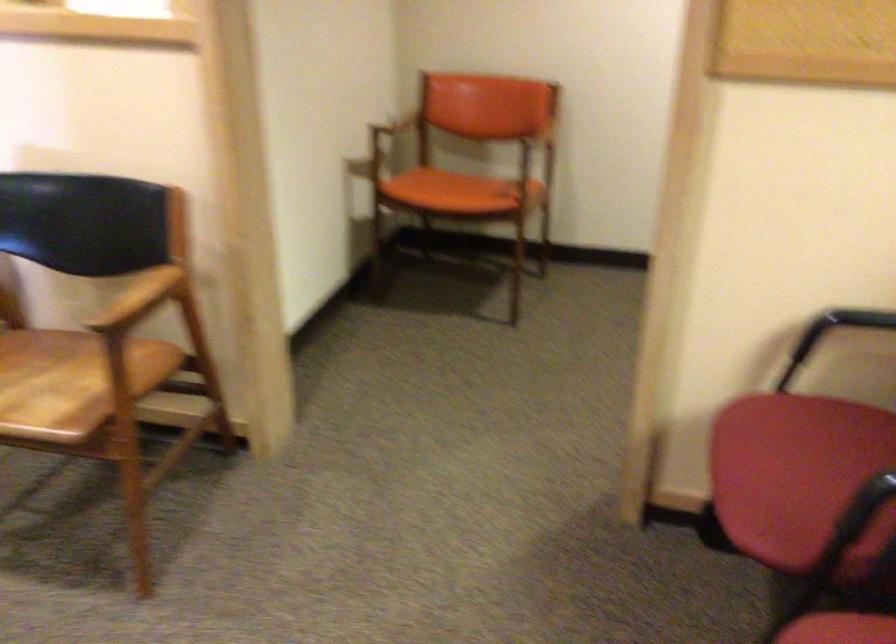
This screenshot has width=896, height=644. Describe the element at coordinates (798, 477) in the screenshot. I see `the red chair sitting surface` at that location.